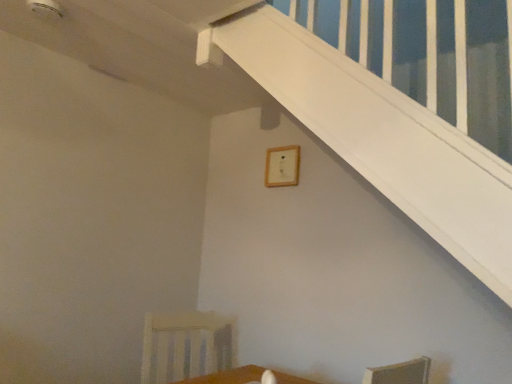
Question: Is wooden frame at upper center bigger or smaller than white wood armchair at lower left?

Choices:
 (A) big
 (B) small

Answer: (B)

Question: Is wooden frame at upper center taller or shorter than white wood armchair at lower left?

Choices:
 (A) tall
 (B) short

Answer: (B)

Question: Considering their positions, is wooden frame at upper center located in front of or behind white wood armchair at lower left?

Choices:
 (A) front
 (B) behind

Answer: (B)

Question: Considering the positions of white wood armchair at lower left and wooden frame at upper center in the image, is white wood armchair at lower left bigger or smaller than wooden frame at upper center?

Choices:
 (A) small
 (B) big

Answer: (B)

Question: Is white wood armchair at lower left taller or shorter than wooden frame at upper center?

Choices:
 (A) tall
 (B) short

Answer: (A)

Question: From the image's perspective, relative to wooden frame at upper center, is white wood armchair at lower left above or below?

Choices:
 (A) above
 (B) below

Answer: (B)

Question: Do you think white wood armchair at lower left is within wooden frame at upper center, or outside of it?

Choices:
 (A) inside
 (B) outside

Answer: (B)